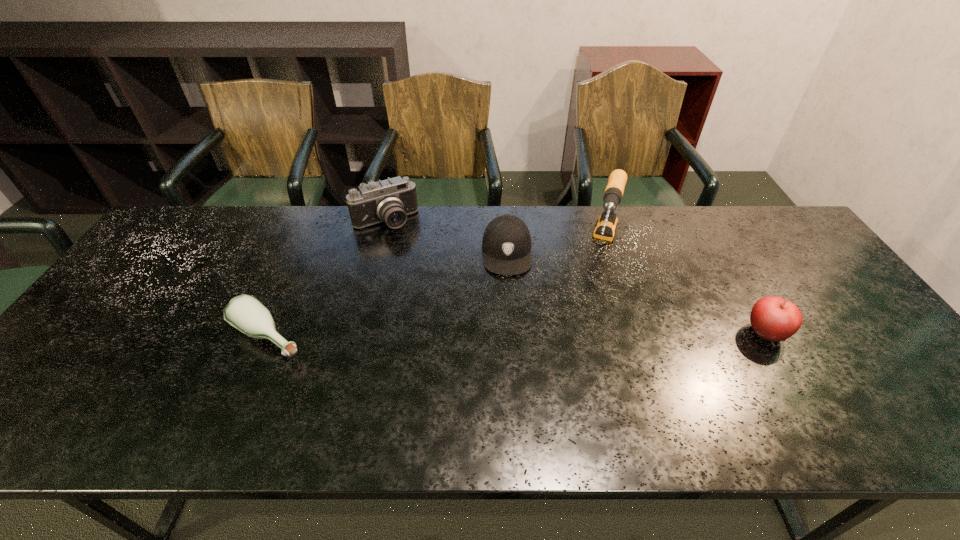
You are a GUI agent. You are given a task and a screenshot of the screen. Output one action in this format:
    pyautogui.click(x=<x>, y=<y>)
    Task: Click on the vacant space located 0.370m on the front-facing side of the third object from left to right
    The width and height of the screenshot is (960, 540).
    Given the screenshot: What is the action you would take?
    pyautogui.click(x=508, y=392)

This screenshot has width=960, height=540. Identify the location of vacant space located on the front-facing side of the third object from left to right. (508, 380).

The image size is (960, 540). I want to click on vacant space positioned 0.280m on the front-facing side of the third object from left to right, so click(508, 359).

Where is `free space located on the handle side of the drill`? The image size is (960, 540). free space located on the handle side of the drill is located at coordinates (594, 316).

Image resolution: width=960 pixels, height=540 pixels. Identify the location of vacant space situated 0.100m on the handle side of the drill. (599, 298).

Locate an element on the screen. The image size is (960, 540). blank space located 0.400m on the handle side of the drill is located at coordinates (576, 388).

You are a GUI agent. You are given a task and a screenshot of the screen. Output one action in this format:
    pyautogui.click(x=<x>, y=<y>)
    Task: Click on the free spot located on the front-facing side of the second object from left to right
    
    Given the screenshot: What is the action you would take?
    pyautogui.click(x=403, y=246)

The image size is (960, 540). In order to click on vacant region located 0.140m on the front-facing side of the second object from left to right in this screenshot , I will do `click(413, 261)`.

You are a GUI agent. You are given a task and a screenshot of the screen. Output one action in this format:
    pyautogui.click(x=<x>, y=<y>)
    Task: Click on the vacant space positioned on the front-facing side of the second object from left to right
    The image size is (960, 540).
    Given the screenshot: What is the action you would take?
    pyautogui.click(x=410, y=258)

You are a GUI agent. You are given a task and a screenshot of the screen. Output one action in this format:
    pyautogui.click(x=<x>, y=<y>)
    Task: Click on the cap at the far edge
    This screenshot has width=960, height=540.
    Given the screenshot: What is the action you would take?
    pyautogui.click(x=506, y=242)